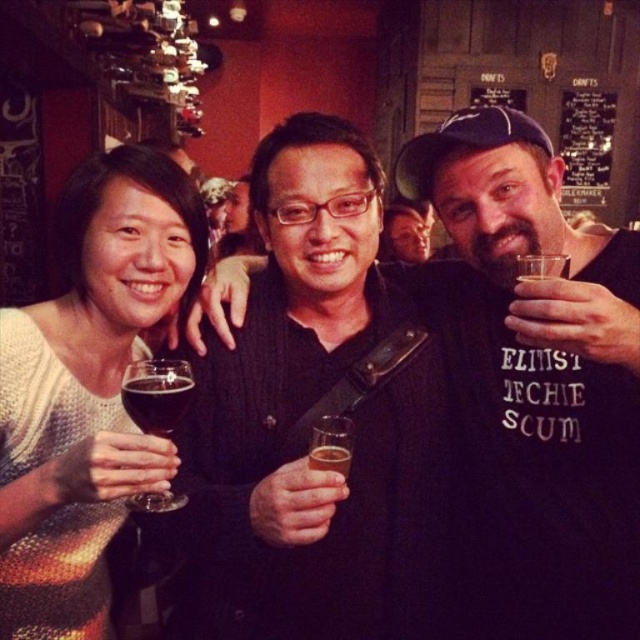
Between point (129, 243) and point (172, 364), which one is positioned behind?

Positioned behind is point (129, 243).

Does point (35, 504) come in front of point (138, 403)?

Yes, it is in front of point (138, 403).

You are a GUI agent. You are given a task and a screenshot of the screen. Output one action in this format:
    pyautogui.click(x=<x>, y=<y>)
    Task: Click on the knitted sweater at left
    The width and height of the screenshot is (640, 640).
    Given the screenshot: What is the action you would take?
    pyautogui.click(x=88, y=388)

Can you confirm if knitted sweater at left is smaller than black matte shirt at center?

Correct, knitted sweater at left occupies less space than black matte shirt at center.

Who is positioned more to the right, knitted sweater at left or black matte shirt at center?

black matte shirt at center is more to the right.

In order to click on knitted sweater at left in this screenshot , I will do `click(88, 388)`.

Which is behind, point (61, 497) or point (333, 448)?

Positioned behind is point (333, 448).

Measure the distance between point [157,196] and camera.

They are 3.78 feet apart.

Describe the element at coordinates (88, 388) in the screenshot. I see `knitted sweater at left` at that location.

Find the location of a particular element. Image resolution: width=640 pixels, height=640 pixels. knitted sweater at left is located at coordinates (88, 388).